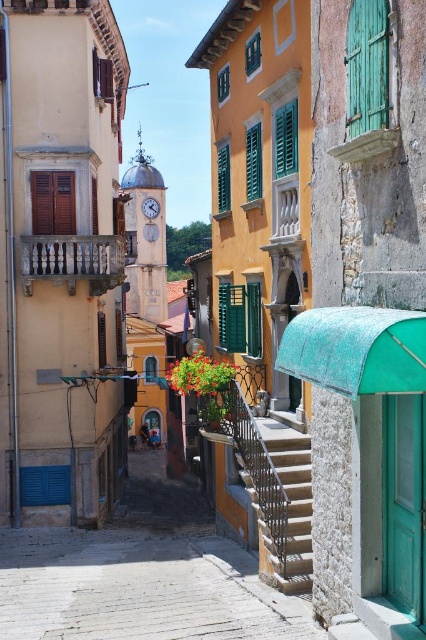
Question: Does smooth stone steps at center come in front of brown wooden shutters at left?

Choices:
 (A) yes
 (B) no

Answer: (A)

Question: Which of the following is the closest to the observer?

Choices:
 (A) (256, 493)
 (B) (249, 156)

Answer: (A)

Question: Which point appears farthest from the camera in this image?

Choices:
 (A) (386, 3)
 (B) (106, 605)
 (C) (39, 195)

Answer: (C)

Question: Can you confirm if rustic metal stairs at lower right is positioned below green wooden shutter at upper right?

Choices:
 (A) yes
 (B) no

Answer: (A)

Question: Based on their relative distances, which object is nearer to the green wooden shutter at upper right?

Choices:
 (A) smooth stone steps at center
 (B) green matte shutters at center
 (C) brown wooden shutters at left
 (D) rustic metal stairs at lower right

Answer: (D)

Question: Does green wooden shutter at upper right come behind green matte shutter at upper center?

Choices:
 (A) no
 (B) yes

Answer: (A)